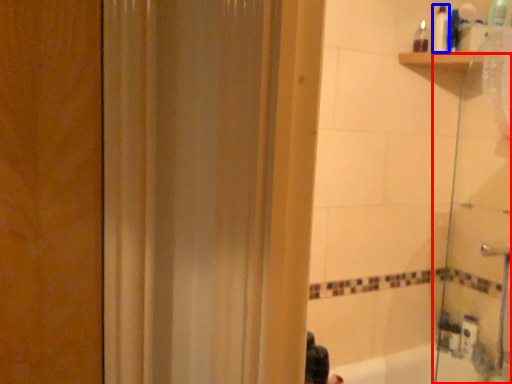
Question: Which object is further to the camera taking this photo, shower door (highlighted by a red box) or toiletry (highlighted by a blue box)?

Choices:
 (A) shower door
 (B) toiletry

Answer: (B)